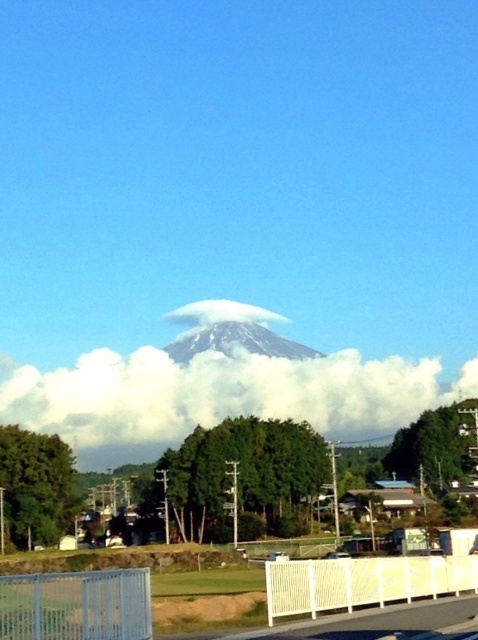
You are a photographer planning to capture the iconic mountain in the image. You want to ensure the white fluffy cloud at center is positioned exactly at the center of your photo. Based on the coordinates provided, is the cloud already centered?

The white fluffy cloud at center is positioned at coordinates point (221, 394), which is not exactly at the center of the photo. The center would be at coordinates (239, 320). Therefore, the cloud is slightly to the right and above the true center.